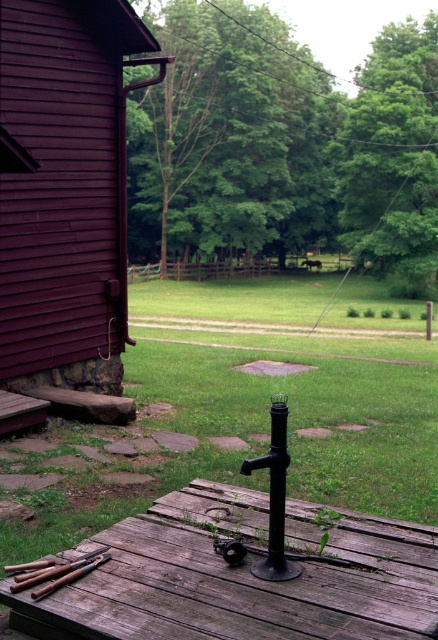
Question: Is rustic wood deck at center to the left of black matte pole at center from the viewer's perspective?

Choices:
 (A) yes
 (B) no

Answer: (A)

Question: Among these points, which one is nearest to the camera?

Choices:
 (A) (402, 602)
 (B) (293, 570)

Answer: (A)

Question: Which object is closer to the camera taking this photo?

Choices:
 (A) wooden handles at lower left
 (B) rustic wood deck at center

Answer: (B)

Question: Which is farther from the black matte pole at center?

Choices:
 (A) wooden handles at lower left
 (B) matte purple siding at left
 (C) rustic wood deck at center

Answer: (B)

Question: Can you confirm if rustic wood deck at center is positioned to the right of black matte pole at center?

Choices:
 (A) yes
 (B) no

Answer: (B)

Question: Does rustic wood deck at center have a lesser width compared to wooden handles at lower left?

Choices:
 (A) no
 (B) yes

Answer: (A)